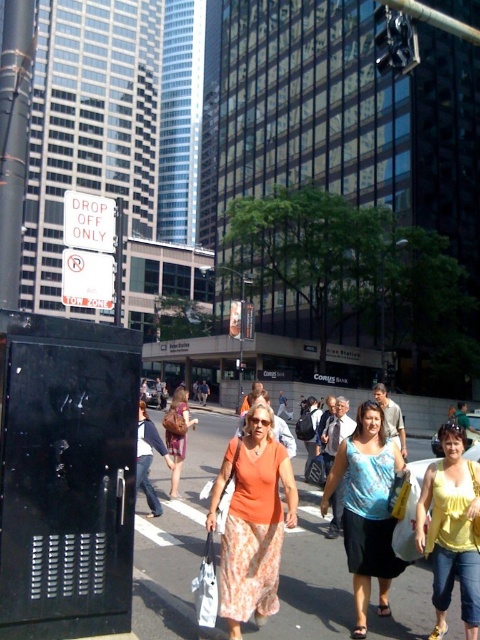
Does metallic at upper center lie behind orange fabric dress at center?

No, metallic at upper center is in front of orange fabric dress at center.

Does metallic at upper center have a smaller size compared to orange fabric dress at center?

No, metallic at upper center is not smaller than orange fabric dress at center.

Who is more forward, [403,56] or [206,387]?

Point [403,56]

Identify the location of metallic at upper center. (395, 42).

Is point (396, 406) less distant than point (456, 406)?

Yes, point (396, 406) is in front of point (456, 406).

Is matte orange tank top at center taller than light blue denim jeans at center?

In fact, matte orange tank top at center may be shorter than light blue denim jeans at center.

Identify the location of matte orange tank top at center. Image resolution: width=480 pixels, height=640 pixels. (391, 417).

Does orange fabric skirt at center appear over blue cotton tank top at center?

Yes.

Can you confirm if orange fabric skirt at center is taller than blue cotton tank top at center?

Correct, orange fabric skirt at center is much taller as blue cotton tank top at center.

This screenshot has width=480, height=640. Find the location of `orange fabric skirt at center`. orange fabric skirt at center is located at coordinates (252, 520).